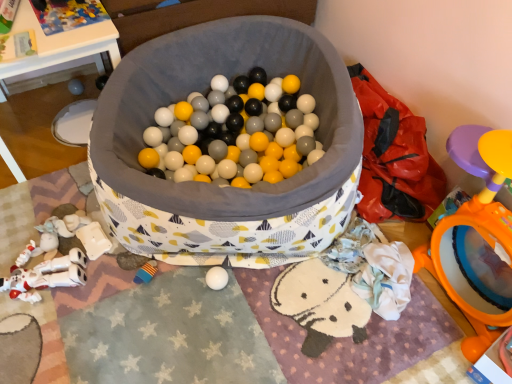
At what (x,y) coordinates should I click in order to perform the action: click on free spot in front of white plush toy at lower left, which is the 4th toy in top-to-bottom order. Please return your answer as a coordinate pair (x, y). The height and width of the screenshot is (384, 512). Looking at the image, I should click on (41, 338).